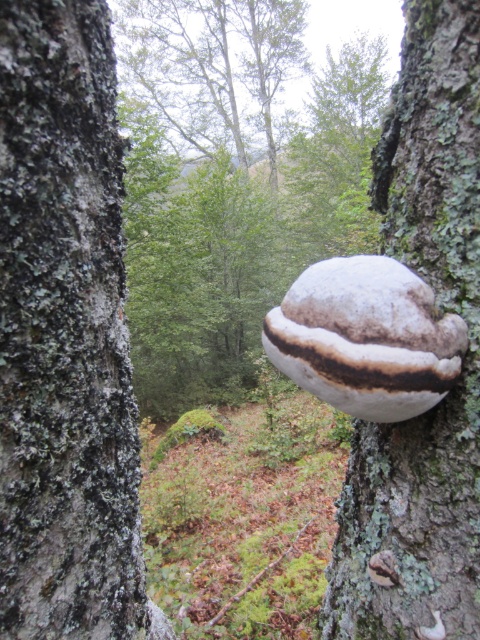
Question: Which point is farther from the camera taking this photo?

Choices:
 (A) (417, 276)
 (B) (210, 173)

Answer: (B)

Question: Is white fuzzy fungus at center behind white fuzzy growth at center?

Choices:
 (A) no
 (B) yes

Answer: (B)

Question: Is white fuzzy growth at center in front of white matte fungus at right?

Choices:
 (A) yes
 (B) no

Answer: (B)

Question: Which object is the farthest from the white fuzzy fungus at center?

Choices:
 (A) white fuzzy growth at center
 (B) smooth gray bark at center

Answer: (A)

Question: Based on their relative distances, which object is farther from the white matte fungus at right?

Choices:
 (A) smooth gray bark at center
 (B) white fuzzy fungus at center
 (C) white fuzzy growth at center

Answer: (B)

Question: Does white fuzzy fungus at center appear on the right side of white fuzzy growth at center?

Choices:
 (A) yes
 (B) no

Answer: (B)